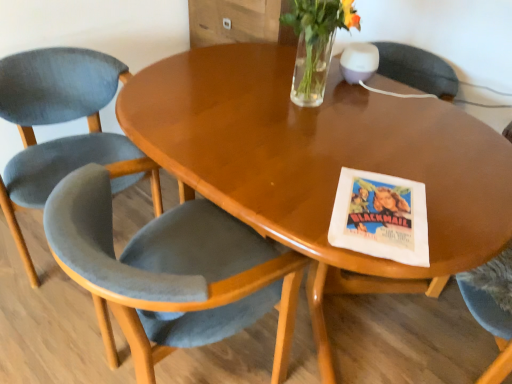
Question: From a real-world perspective, is velvet grey chair at lower left, the first chair viewed from the right, on top of velvet grey chair at left, which is counted as the 2th chair, starting from the right?

Choices:
 (A) no
 (B) yes

Answer: (B)

Question: Is velvet grey chair at lower left, the first chair viewed from the right, at the right side of velvet grey chair at left, which is counted as the 2th chair, starting from the right?

Choices:
 (A) no
 (B) yes

Answer: (B)

Question: From a real-world perspective, is velvet grey chair at lower left, marked as the 2th chair in a left-to-right arrangement, located beneath velvet grey chair at left, which is counted as the 2th chair, starting from the right?

Choices:
 (A) yes
 (B) no

Answer: (B)

Question: Is velvet grey chair at lower left, the first chair viewed from the right, facing towards velvet grey chair at left, the first chair positioned from the left?

Choices:
 (A) no
 (B) yes

Answer: (A)

Question: Can velvet grey chair at left, which is counted as the 2th chair, starting from the right, be found inside velvet grey chair at lower left, the first chair viewed from the right?

Choices:
 (A) no
 (B) yes

Answer: (A)

Question: From the image's perspective, relative to clear glass vase at upper center, is glossy wood table at center above or below?

Choices:
 (A) above
 (B) below

Answer: (B)

Question: Is point (373, 142) positioned closer to the camera than point (325, 56)?

Choices:
 (A) closer
 (B) farther

Answer: (A)

Question: Considering the positions of glossy wood table at center and clear glass vase at upper center in the image, is glossy wood table at center bigger or smaller than clear glass vase at upper center?

Choices:
 (A) small
 (B) big

Answer: (B)

Question: Would you say glossy wood table at center is to the left or to the right of clear glass vase at upper center in the picture?

Choices:
 (A) left
 (B) right

Answer: (A)

Question: Considering the positions of point (320, 23) and point (489, 185), is point (320, 23) closer or farther from the camera than point (489, 185)?

Choices:
 (A) farther
 (B) closer

Answer: (A)

Question: Based on their positions, is clear glass vase at upper center located to the left or right of glossy wood table at center?

Choices:
 (A) right
 (B) left

Answer: (A)

Question: From the image's perspective, is clear glass vase at upper center located above or below glossy wood table at center?

Choices:
 (A) below
 (B) above

Answer: (B)

Question: From a real-world perspective, relative to glossy wood table at center, is clear glass vase at upper center vertically above or below?

Choices:
 (A) above
 (B) below

Answer: (A)

Question: Is glossy wood table at center spatially inside velvet grey chair at lower left, marked as the 2th chair in a left-to-right arrangement, or outside of it?

Choices:
 (A) outside
 (B) inside

Answer: (A)

Question: Considering the positions of point (303, 203) and point (220, 322), is point (303, 203) closer or farther from the camera than point (220, 322)?

Choices:
 (A) closer
 (B) farther

Answer: (A)